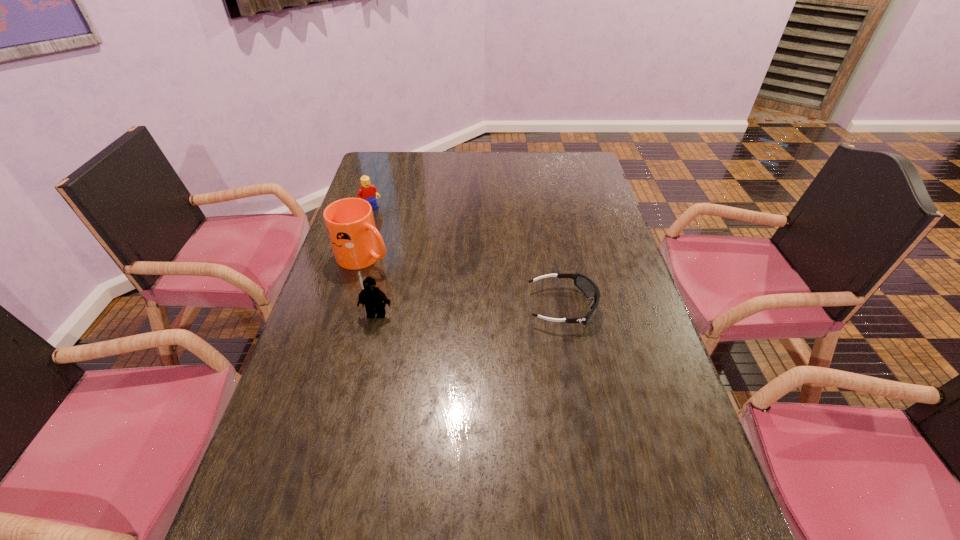
The width and height of the screenshot is (960, 540). What are the coordinates of `the nearer Lego` in the screenshot? It's located at (372, 297).

Locate an element on the screen. Image resolution: width=960 pixels, height=540 pixels. the shortest object is located at coordinates (x=586, y=285).

At what (x,y) coordinates should I click in order to perform the action: click on the rightmost object. Please return your answer as a coordinate pair (x, y). Image resolution: width=960 pixels, height=540 pixels. Looking at the image, I should click on (586, 285).

I want to click on the tallest object, so click(x=355, y=241).

The width and height of the screenshot is (960, 540). Find the location of `the third nearest object`. the third nearest object is located at coordinates (355, 241).

What are the coordinates of `the left Lego` in the screenshot? It's located at (368, 192).

You are a GUI agent. You are given a task and a screenshot of the screen. Output one action in this format:
    pyautogui.click(x=<x>, y=<y>)
    Task: Click on the farther Lego
    
    Given the screenshot: What is the action you would take?
    pyautogui.click(x=368, y=192)

Find the location of a particular element. The height and width of the screenshot is (540, 960). free region located on the face of the nearer Lego is located at coordinates (354, 410).

Identify the location of free space located on the front and sides of the goggles. (625, 307).

The width and height of the screenshot is (960, 540). I want to click on free spot located 0.370m on the handle side of the tallest object, so click(492, 313).